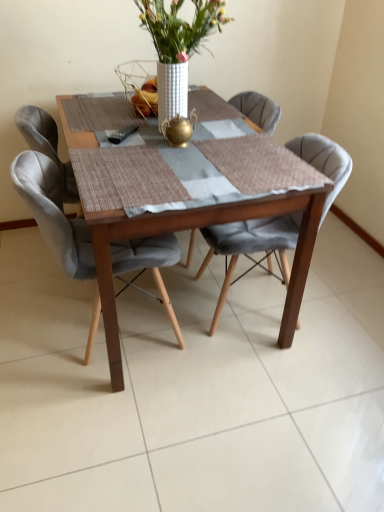
Describe the element at coordinates (182, 192) in the screenshot. The width and height of the screenshot is (384, 512). I see `wooden table at center` at that location.

I want to click on white textured vase at center, so click(x=178, y=46).

At what (x,y) coordinates should I click in order to perform the action: click on velvet grey chair at center, which is the second chair from left to right. Please return your answer as a coordinate pair (x, y). The height and width of the screenshot is (512, 384). Looking at the image, I should click on (250, 247).

Find the location of a particular element. This screenshot has width=384, height=512. velvet grey chair at center, the 1th chair viewed from the left is located at coordinates (54, 213).

Is point (226, 241) positioned after point (166, 160)?

Yes, it is behind point (166, 160).

Is velvet grey chair at center, which is the second chair from left to right, wider than wooden table at center?

In fact, velvet grey chair at center, which is the second chair from left to right, might be narrower than wooden table at center.

How different are the orientations of velvet grey chair at center, the 1th chair viewed from the right, and wooden table at center in degrees?

They differ by 90 degrees in their facing directions.

Is point (124, 253) farther from viewer compared to point (187, 34)?

That is True.

From the image's perspective, between velvet grey chair at center, the second chair in the right-to-left sequence, and white textured vase at center, which one is located above?

white textured vase at center appears higher in the image.

The image size is (384, 512). In order to click on houseplant lying on the right of velvet grey chair at center, the 1th chair viewed from the left in this screenshot , I will do `click(178, 46)`.

Is velvet grey chair at center, the second chair in the right-to-left sequence, facing towards white textured vase at center?

No, velvet grey chair at center, the second chair in the right-to-left sequence, is not turned towards white textured vase at center.

From the image's perspective, which one is positioned higher, white textured vase at center or velvet grey chair at center, which is the second chair from left to right?

white textured vase at center is shown above in the image.

Looking at their sizes, would you say white textured vase at center is wider or thinner than velvet grey chair at center, which is the second chair from left to right?

Considering their sizes, white textured vase at center looks slimmer than velvet grey chair at center, which is the second chair from left to right.

Which is in front, white textured vase at center or velvet grey chair at center, the 1th chair viewed from the right?

Positioned in front is white textured vase at center.

From a real-world perspective, count 2nd chairs downward from the white textured vase at center and point to it. Please provide its 2D coordinates.

[(250, 247)]

Would you consider wooden table at center to be distant from velvet grey chair at center, which is the second chair from left to right?

That's not correct — wooden table at center is a little close to velvet grey chair at center, which is the second chair from left to right.

Could you tell me if wooden table at center is facing velvet grey chair at center, which is the second chair from left to right?

No, wooden table at center is not oriented towards velvet grey chair at center, which is the second chair from left to right.

From the image's perspective, who appears lower, wooden table at center or velvet grey chair at center, which is the second chair from left to right?

velvet grey chair at center, which is the second chair from left to right, from the image's perspective.

From a real-world perspective, is wooden table at center physically above velvet grey chair at center, which is the second chair from left to right?

Yes, from a real-world perspective, wooden table at center is over velvet grey chair at center, which is the second chair from left to right

Is velvet grey chair at center, the second chair in the right-to-left sequence, smaller than wooden table at center?

Yes.

Between velvet grey chair at center, the second chair in the right-to-left sequence, and wooden table at center, which one appears on the right side from the viewer's perspective?

Positioned to the right is wooden table at center.

From the image's perspective, between velvet grey chair at center, the 1th chair viewed from the left, and wooden table at center, which one is located above?

From the image's view, wooden table at center is above.

From a real-world perspective, is wooden table at center physically below white textured vase at center?

Yes.

Is wooden table at center not near white textured vase at center?

wooden table at center is actually quite close to white textured vase at center.

Is point (267, 170) closer to viewer compared to point (168, 35)?

Yes, it is in front of point (168, 35).

Could you tell me if wooden table at center is turned towards velvet grey chair at center, the 1th chair viewed from the left?

No, wooden table at center is not aimed at velvet grey chair at center, the 1th chair viewed from the left.

Is point (191, 158) closer or farther from the camera than point (132, 262)?

Point (191, 158) appears to be farther away from the viewer than point (132, 262).

Can you confirm if wooden table at center is thinner than velvet grey chair at center, the 1th chair viewed from the left?

Incorrect, the width of wooden table at center is not less than that of velvet grey chair at center, the 1th chair viewed from the left.

From a real-world perspective, is wooden table at center beneath velvet grey chair at center, the 1th chair viewed from the left?

Indeed, from a real-world perspective, wooden table at center is positioned beneath velvet grey chair at center, the 1th chair viewed from the left.

Where is `kitchen & dining room table on the left side of velvet grey chair at center, which is the second chair from left to right`? kitchen & dining room table on the left side of velvet grey chair at center, which is the second chair from left to right is located at coordinates (182, 192).

Identify the location of the 2nd chair positioned below the white textured vase at center (from the image's perspective). (54, 213).

Which object lies nearer to the anchor point wooden table at center, white textured vase at center or velvet grey chair at center, the 1th chair viewed from the left?

velvet grey chair at center, the 1th chair viewed from the left, is closer to wooden table at center.

Which object lies further to the anchor point wooden table at center, velvet grey chair at center, the 1th chair viewed from the right, or velvet grey chair at center, the second chair in the right-to-left sequence?

Based on the image, velvet grey chair at center, the 1th chair viewed from the right, appears to be further to wooden table at center.

Considering their positions, is wooden table at center positioned further to velvet grey chair at center, the second chair in the right-to-left sequence, than velvet grey chair at center, which is the second chair from left to right?

Based on the image, velvet grey chair at center, which is the second chair from left to right, appears to be further to velvet grey chair at center, the second chair in the right-to-left sequence.

Looking at the image, which one is located closer to velvet grey chair at center, which is the second chair from left to right, wooden table at center or white textured vase at center?

wooden table at center.

From the image, which object appears to be farther from white textured vase at center, velvet grey chair at center, which is the second chair from left to right, or wooden table at center?

velvet grey chair at center, which is the second chair from left to right.

Which object lies nearer to the anchor point velvet grey chair at center, the 1th chair viewed from the left, velvet grey chair at center, the 1th chair viewed from the right, or white textured vase at center?

The object closer to velvet grey chair at center, the 1th chair viewed from the left, is velvet grey chair at center, the 1th chair viewed from the right.

When comparing their distances from velvet grey chair at center, which is the second chair from left to right, does wooden table at center or velvet grey chair at center, the 1th chair viewed from the left, seem closer?

Among the two, wooden table at center is located nearer to velvet grey chair at center, which is the second chair from left to right.

Considering their positions, is velvet grey chair at center, the second chair in the right-to-left sequence, positioned closer to velvet grey chair at center, which is the second chair from left to right, than wooden table at center?

Based on the image, wooden table at center appears to be nearer to velvet grey chair at center, which is the second chair from left to right.

Where is `kitchen & dining room table between white textured vase at center and velvet grey chair at center, which is the second chair from left to right, from top to bottom`? Image resolution: width=384 pixels, height=512 pixels. kitchen & dining room table between white textured vase at center and velvet grey chair at center, which is the second chair from left to right, from top to bottom is located at coordinates (182, 192).

You are a GUI agent. You are given a task and a screenshot of the screen. Output one action in this format:
    pyautogui.click(x=<x>, y=<y>)
    Task: Click on the kitchen & dining room table between velvet grey chair at center, the 1th chair viewed from the left, and velvet grey chair at center, the 1th chair viewed from the right, from left to right
    
    Given the screenshot: What is the action you would take?
    pyautogui.click(x=182, y=192)

You are a GUI agent. You are given a task and a screenshot of the screen. Output one action in this format:
    pyautogui.click(x=<x>, y=<y>)
    Task: Click on the chair between white textured vase at center and velvet grey chair at center, the 1th chair viewed from the left, from top to bottom
    
    Given the screenshot: What is the action you would take?
    pyautogui.click(x=250, y=247)

You are a GUI agent. You are given a task and a screenshot of the screen. Output one action in this format:
    pyautogui.click(x=<x>, y=<y>)
    Task: Click on the kitchen & dining room table between white textured vase at center and velvet grey chair at center, the 1th chair viewed from the left, vertically
    This screenshot has width=384, height=512.
    Given the screenshot: What is the action you would take?
    pyautogui.click(x=182, y=192)